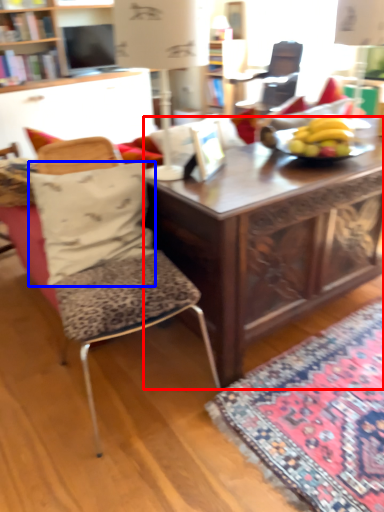
Question: Which point is further to the camera, desk (highlighted by a red box) or pillow (highlighted by a blue box)?

Choices:
 (A) desk
 (B) pillow

Answer: (B)